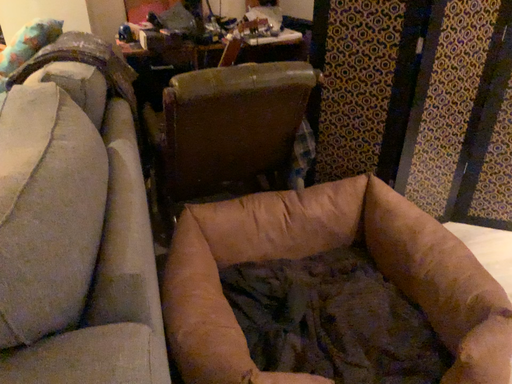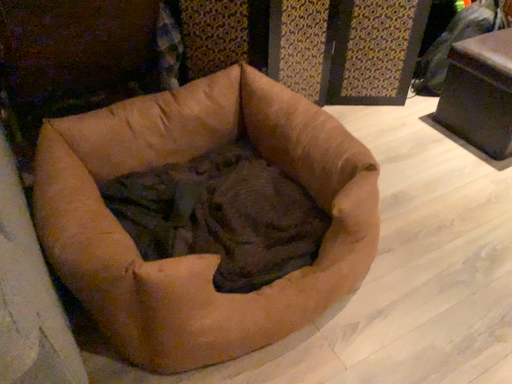
Question: Which way did the camera rotate in the video?

Choices:
 (A) rotated downward
 (B) rotated upward

Answer: (A)